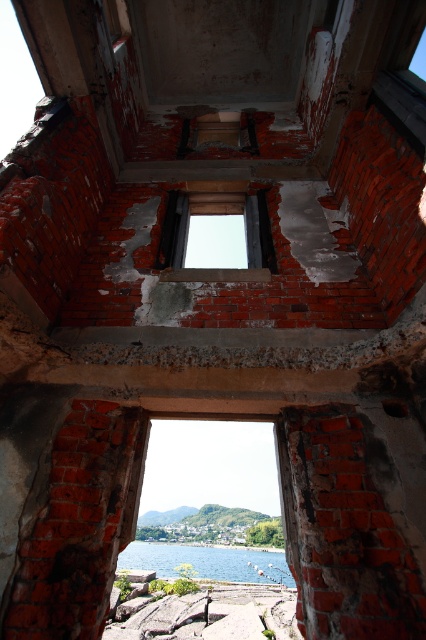
You are an architect assessing the structural integrity of the brick textured window frame at center and the blue water at lower center. Which object is taller in the scene?

The brick textured window frame at center is taller than the blue water at lower center according to the description.